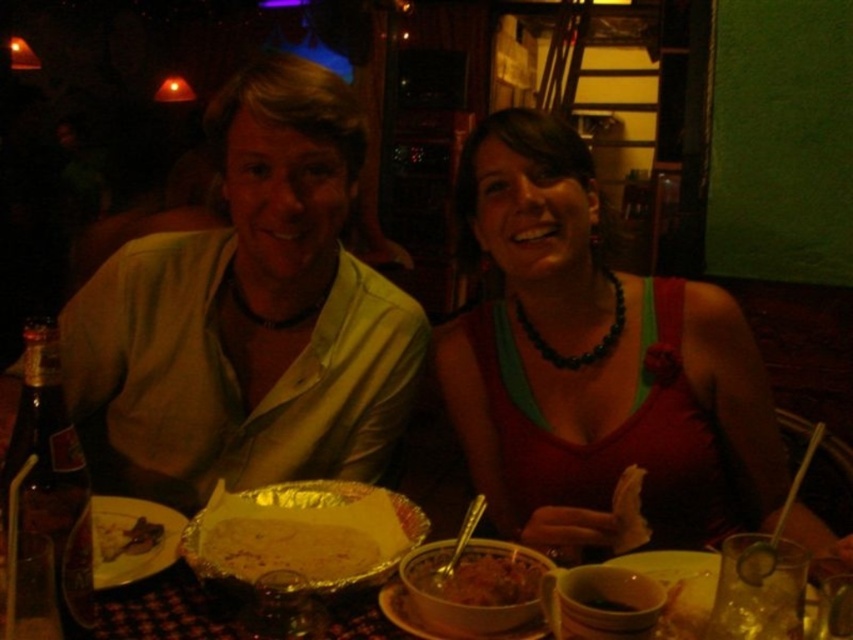
You are a server in the restaurant and need to place a 40 cm wide platter between the matte green dress at center and the shiny aluminum foil at center on the table. Can the platter fit between them?

The distance between the matte green dress at center and the shiny aluminum foil at center is 38.90 centimeters. Since the platter is 40 cm wide, it cannot fit between them as the space is narrower than the platter.

You are a photographer setting up for a photoshoot. You need to position a light source so that it illuminates the matte green dress at center without casting a shadow on the silver foil platter at lower left. Given their height difference, is this possible?

The matte green dress at center is taller than the silver foil platter at lower left. Therefore, positioning the light source above and behind the dress would cast its shadow downward, potentially obscuring the platter. To avoid this, place the light source to the side of the dress so the shadow falls away from the platter.

You are a server at the restaurant and need to place a dessert plate between the matte green dress at center and the shiny aluminum foil at center. Which object should you move to make space?

You should move the shiny aluminum foil at center because the matte green dress at center is wider, so moving the smaller shiny aluminum foil at center would allow more space for the dessert plate.